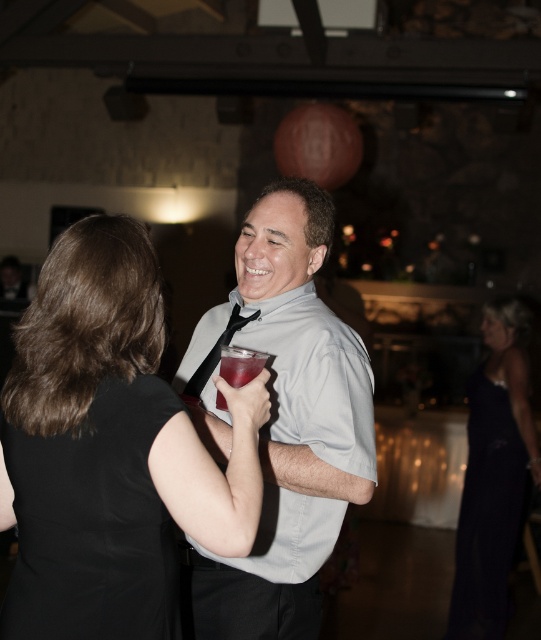
Question: Which object is the closest to the gray matte shirt at center?

Choices:
 (A) translucent plastic cup at center
 (B) black smooth dress at center
 (C) dark velvet dress at lower right

Answer: (A)

Question: Which object is farther from the camera taking this photo?

Choices:
 (A) black satin tie at center
 (B) black smooth dress at center
 (C) black fabric dress at center
 (D) dark velvet dress at lower right

Answer: (D)

Question: Based on their relative distances, which object is nearer to the dark velvet dress at lower right?

Choices:
 (A) black smooth dress at center
 (B) black fabric dress at center

Answer: (B)

Question: Does black smooth dress at center have a smaller size compared to dark velvet dress at lower right?

Choices:
 (A) yes
 (B) no

Answer: (A)

Question: Is black fabric dress at center bigger than gray matte shirt at center?

Choices:
 (A) no
 (B) yes

Answer: (A)

Question: Can you confirm if black fabric dress at center is positioned above dark velvet dress at lower right?

Choices:
 (A) yes
 (B) no

Answer: (A)